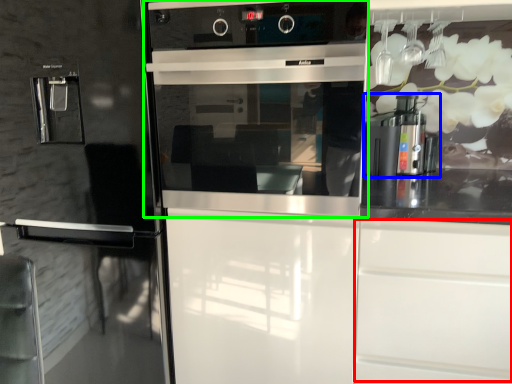
Question: Which object is the farthest from drawer (highlighted by a red box)? Choose among these: coffee machine (highlighted by a blue box) or home appliance (highlighted by a green box).

Choices:
 (A) coffee machine
 (B) home appliance

Answer: (A)